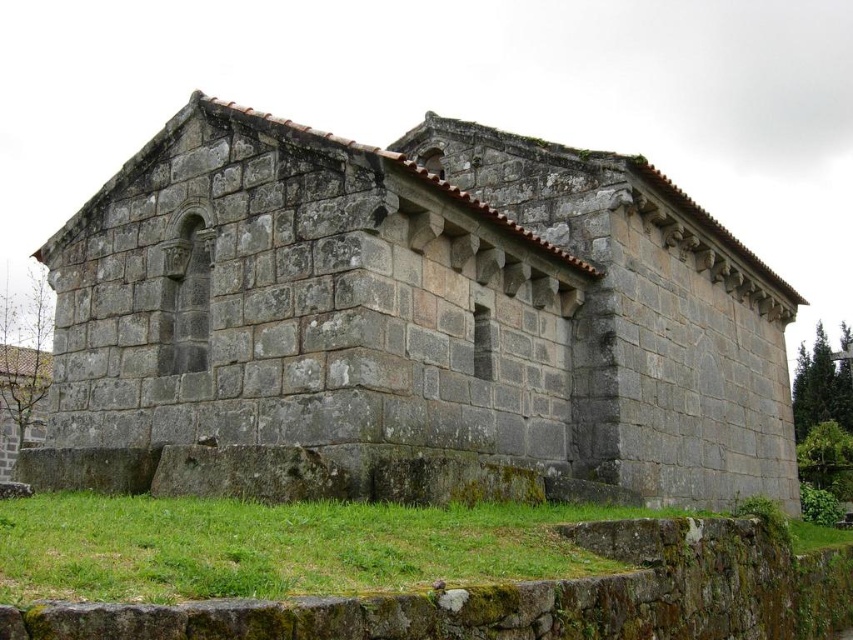
Question: Which object is farther from the camera taking this photo?

Choices:
 (A) gray stone church at center
 (B) green mossy stone at lower center

Answer: (A)

Question: Which object is closer to the camera taking this photo?

Choices:
 (A) gray stone church at center
 (B) green mossy stone at lower center

Answer: (B)

Question: From the image, what is the correct spatial relationship of gray stone church at center in relation to green mossy stone at lower center?

Choices:
 (A) right
 (B) left

Answer: (A)

Question: Which of the following is the farthest from the observer?

Choices:
 (A) (315, 541)
 (B) (469, 406)

Answer: (B)

Question: Does gray stone church at center appear on the left side of green mossy stone at lower center?

Choices:
 (A) no
 (B) yes

Answer: (A)

Question: Considering the relative positions of gray stone church at center and green mossy stone at lower center in the image provided, where is gray stone church at center located with respect to green mossy stone at lower center?

Choices:
 (A) above
 (B) below

Answer: (A)